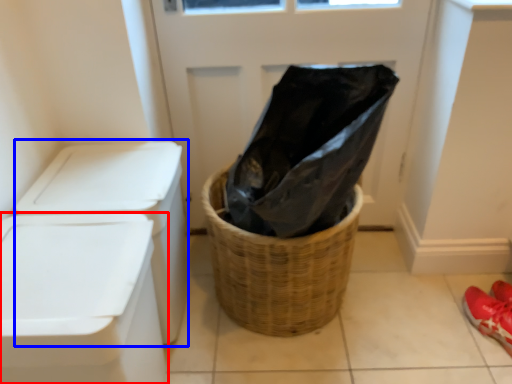
Question: Which object appears farthest to the camera in this image, waste container (highlighted by a red box) or washer (highlighted by a blue box)?

Choices:
 (A) waste container
 (B) washer

Answer: (B)